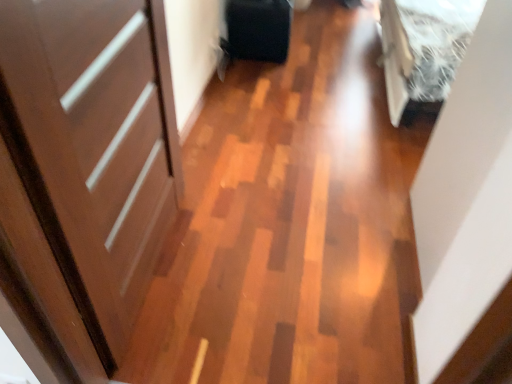
Question: Can matte brown door at left be found inside white fluffy bed at upper right?

Choices:
 (A) no
 (B) yes

Answer: (A)

Question: Are white fluffy bed at upper right and matte brown door at left making contact?

Choices:
 (A) yes
 (B) no

Answer: (B)

Question: Is white fluffy bed at upper right outside of matte brown door at left?

Choices:
 (A) no
 (B) yes

Answer: (B)

Question: From a real-world perspective, is white fluffy bed at upper right physically above matte brown door at left?

Choices:
 (A) yes
 (B) no

Answer: (B)

Question: Considering the relative positions of white fluffy bed at upper right and matte brown door at left in the image provided, is white fluffy bed at upper right to the right of matte brown door at left from the viewer's perspective?

Choices:
 (A) no
 (B) yes

Answer: (B)

Question: Does point (278, 29) appear closer or farther from the camera than point (432, 28)?

Choices:
 (A) closer
 (B) farther

Answer: (B)

Question: Based on their sizes in the image, would you say matte black suitcase at center is bigger or smaller than white fluffy bed at upper right?

Choices:
 (A) big
 (B) small

Answer: (B)

Question: In terms of width, does matte black suitcase at center look wider or thinner when compared to white fluffy bed at upper right?

Choices:
 (A) thin
 (B) wide

Answer: (A)

Question: Considering the positions of matte black suitcase at center and white fluffy bed at upper right in the image, is matte black suitcase at center taller or shorter than white fluffy bed at upper right?

Choices:
 (A) tall
 (B) short

Answer: (B)

Question: Is white fluffy bed at upper right in front of or behind matte black suitcase at center in the image?

Choices:
 (A) front
 (B) behind

Answer: (A)

Question: In terms of size, does white fluffy bed at upper right appear bigger or smaller than matte black suitcase at center?

Choices:
 (A) big
 (B) small

Answer: (A)

Question: Is point (464, 26) positioned closer to the camera than point (266, 8)?

Choices:
 (A) farther
 (B) closer

Answer: (B)

Question: From a real-world perspective, is white fluffy bed at upper right above or below matte black suitcase at center?

Choices:
 (A) above
 (B) below

Answer: (A)

Question: In the image, is matte black suitcase at center positioned in front of or behind matte brown door at left?

Choices:
 (A) behind
 (B) front

Answer: (A)

Question: Looking at their shapes, would you say matte black suitcase at center is wider or thinner than matte brown door at left?

Choices:
 (A) wide
 (B) thin

Answer: (A)